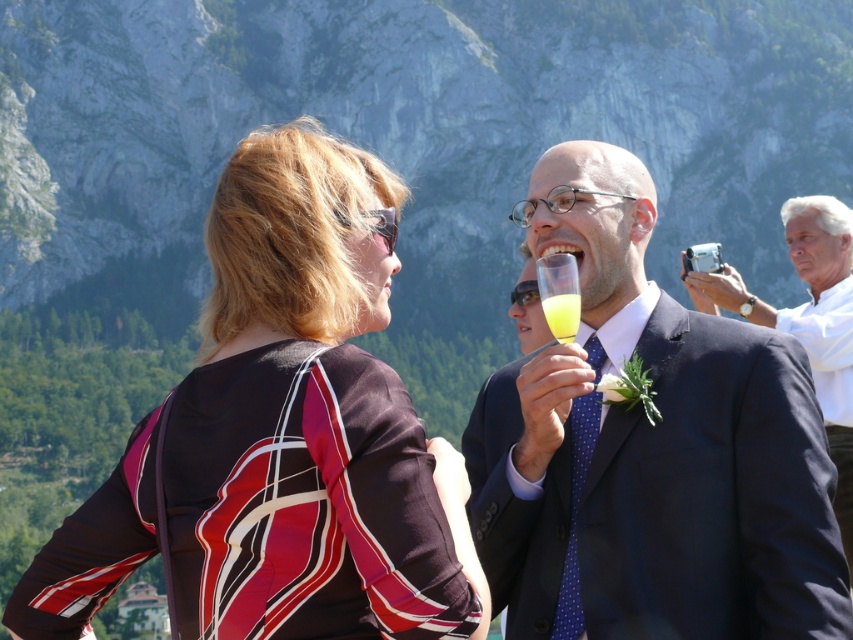
Question: Which point is farther from the camera taking this photo?

Choices:
 (A) (840, 273)
 (B) (532, 566)

Answer: (A)

Question: Does white matte suit at upper right have a lesser width compared to translucent glass at upper center?

Choices:
 (A) no
 (B) yes

Answer: (A)

Question: Can you confirm if rocky mountain at upper center is positioned to the left of matte black suit at center?

Choices:
 (A) yes
 (B) no

Answer: (B)

Question: Does printed silk blouse at upper left appear on the left side of matte black suit at center?

Choices:
 (A) yes
 (B) no

Answer: (A)

Question: Among these points, which one is farthest from the camera?

Choices:
 (A) (300, 461)
 (B) (552, 305)
 (C) (833, 308)
 (D) (555, 141)

Answer: (D)

Question: Which point is farther to the camera?

Choices:
 (A) (596, 35)
 (B) (584, 163)
 (C) (398, 390)
 (D) (711, 276)

Answer: (A)